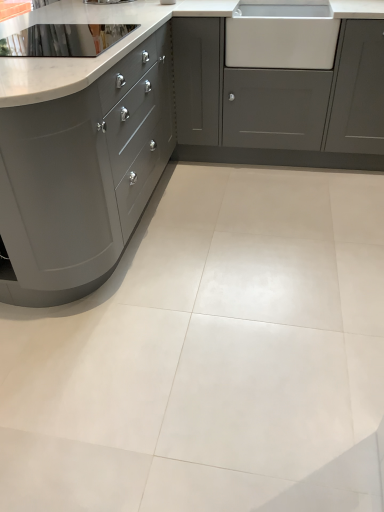
This screenshot has height=512, width=384. Describe the element at coordinates (211, 356) in the screenshot. I see `white glossy tile at center` at that location.

What is the approximate width of white glossy sink at upper right?

23.63 inches.

How much space does matte gray cabinet at center, marked as the second cabinetry in a left-to-right arrangement, occupy vertically?

The height of matte gray cabinet at center, marked as the second cabinetry in a left-to-right arrangement, is 36.86 inches.

Image resolution: width=384 pixels, height=512 pixels. Identify the location of white glossy tile at center. (211, 356).

From the image's perspective, is white glossy tile at center above or below matte gray cabinetry at left, marked as the first cabinetry in a left-to-right arrangement?

Based on their image positions, white glossy tile at center is located beneath matte gray cabinetry at left, marked as the first cabinetry in a left-to-right arrangement.

How different are the orientations of white glossy tile at center and matte gray cabinetry at left, marked as the first cabinetry in a left-to-right arrangement, in degrees?

The facing directions of white glossy tile at center and matte gray cabinetry at left, marked as the first cabinetry in a left-to-right arrangement, are 1.12 degrees apart.

Locate an element on the screen. ceramic tile in front of the matte gray cabinetry at left, marked as the first cabinetry in a left-to-right arrangement is located at coordinates (211, 356).

From a real-world perspective, which is physically below, white glossy tile at center or matte gray cabinetry at left, which is counted as the 2th cabinetry, starting from the right?

white glossy tile at center is physically lower.

Where is `the 2nd cabinetry below the white glossy sink at upper right (from a real-world perspective)`? The image size is (384, 512). the 2nd cabinetry below the white glossy sink at upper right (from a real-world perspective) is located at coordinates (279, 103).

Considering the relative sizes of matte gray cabinet at center, marked as the second cabinetry in a left-to-right arrangement, and white glossy sink at upper right in the image provided, is matte gray cabinet at center, marked as the second cabinetry in a left-to-right arrangement, bigger than white glossy sink at upper right?

Correct, matte gray cabinet at center, marked as the second cabinetry in a left-to-right arrangement, is larger in size than white glossy sink at upper right.

Is white glossy sink at upper right located within matte gray cabinet at center, marked as the second cabinetry in a left-to-right arrangement?

Yes.

From the image's perspective, is white glossy sink at upper right on white glossy tile at center?

Yes, from the image's perspective, white glossy sink at upper right is above white glossy tile at center.

Is white glossy tile at center at the back of white glossy sink at upper right?

No, white glossy sink at upper right's orientation is not away from white glossy tile at center.

What's the angular difference between white glossy sink at upper right and white glossy tile at center's facing directions?

89 degrees.

Which point is more distant from viewer, [312,68] or [82,304]?

The point [312,68] is farther.

Who is smaller, matte gray cabinetry at left, which is counted as the 2th cabinetry, starting from the right, or polished stainless steel sink at upper left?

polished stainless steel sink at upper left.

Considering the positions of point (121, 146) and point (83, 47), is point (121, 146) closer or farther from the camera than point (83, 47)?

Point (121, 146).

From a real-world perspective, which is physically below, matte gray cabinetry at left, marked as the first cabinetry in a left-to-right arrangement, or polished stainless steel sink at upper left?

matte gray cabinetry at left, marked as the first cabinetry in a left-to-right arrangement, from a real-world perspective.

Which object is thinner, matte gray cabinetry at left, which is counted as the 2th cabinetry, starting from the right, or polished stainless steel sink at upper left?

Thinner between the two is polished stainless steel sink at upper left.

Consider the image. Who is bigger, white glossy sink at upper right or polished stainless steel sink at upper left?

With larger size is white glossy sink at upper right.

Is white glossy sink at upper right in front of or behind polished stainless steel sink at upper left in the image?

white glossy sink at upper right is behind polished stainless steel sink at upper left.

Is polished stainless steel sink at upper left surrounding matte gray cabinetry at left, marked as the first cabinetry in a left-to-right arrangement?

No, matte gray cabinetry at left, marked as the first cabinetry in a left-to-right arrangement, is not inside polished stainless steel sink at upper left.

Which is closer to the camera, [9,42] or [148,45]?

Point [9,42] is positioned farther from the camera compared to point [148,45].

Image resolution: width=384 pixels, height=512 pixels. What are the coordinates of `cabinetry that appears in front of the polished stainless steel sink at upper left` in the screenshot? It's located at (82, 176).

In the scene shown: From a real-world perspective, is polished stainless steel sink at upper left physically above matte gray cabinetry at left, marked as the first cabinetry in a left-to-right arrangement?

Yes, from a real-world perspective, polished stainless steel sink at upper left is above matte gray cabinetry at left, marked as the first cabinetry in a left-to-right arrangement.

From the image's perspective, does polished stainless steel sink at upper left appear higher than white glossy sink at upper right?

No, from the image's perspective, polished stainless steel sink at upper left is not on top of white glossy sink at upper right.

Which point is more forward, (84, 56) or (245, 54)?

The point (84, 56) is closer.

From a real-world perspective, is polished stainless steel sink at upper left over white glossy sink at upper right?

Indeed, from a real-world perspective, polished stainless steel sink at upper left stands above white glossy sink at upper right.

Is polished stainless steel sink at upper left far away from white glossy sink at upper right?

No.

Where is `cabinetry on the left of white glossy tile at center`? The image size is (384, 512). cabinetry on the left of white glossy tile at center is located at coordinates (82, 176).

Locate an element on the screen. sink above the matte gray cabinet at center, the first cabinetry positioned from the right (from a real-world perspective) is located at coordinates (281, 35).

Which object lies further to the anchor point white glossy tile at center, white glossy sink at upper right or matte gray cabinet at center, marked as the second cabinetry in a left-to-right arrangement?

Among the two, white glossy sink at upper right is located further to white glossy tile at center.

Based on their spatial positions, is white glossy tile at center or polished stainless steel sink at upper left further from matte gray cabinetry at left, which is counted as the 2th cabinetry, starting from the right?

The object further to matte gray cabinetry at left, which is counted as the 2th cabinetry, starting from the right, is white glossy tile at center.

Considering their positions, is matte gray cabinetry at left, marked as the first cabinetry in a left-to-right arrangement, positioned closer to polished stainless steel sink at upper left than matte gray cabinet at center, marked as the second cabinetry in a left-to-right arrangement?

Based on the image, matte gray cabinetry at left, marked as the first cabinetry in a left-to-right arrangement, appears to be nearer to polished stainless steel sink at upper left.

Considering their positions, is matte gray cabinetry at left, which is counted as the 2th cabinetry, starting from the right, positioned further to white glossy tile at center than white glossy sink at upper right?

white glossy sink at upper right.

In the scene shown: Looking at the image, which one is located closer to white glossy sink at upper right, white glossy tile at center or matte gray cabinetry at left, which is counted as the 2th cabinetry, starting from the right?

matte gray cabinetry at left, which is counted as the 2th cabinetry, starting from the right, is positioned closer to the anchor white glossy sink at upper right.

Looking at this image, which object lies further to the anchor point matte gray cabinet at center, the first cabinetry positioned from the right, white glossy tile at center or matte gray cabinetry at left, marked as the first cabinetry in a left-to-right arrangement?

Based on the image, white glossy tile at center appears to be further to matte gray cabinet at center, the first cabinetry positioned from the right.

Which object lies further to the anchor point matte gray cabinetry at left, marked as the first cabinetry in a left-to-right arrangement, matte gray cabinet at center, the first cabinetry positioned from the right, or white glossy sink at upper right?

The object further to matte gray cabinetry at left, marked as the first cabinetry in a left-to-right arrangement, is matte gray cabinet at center, the first cabinetry positioned from the right.

Which object lies nearer to the anchor point polished stainless steel sink at upper left, matte gray cabinet at center, the first cabinetry positioned from the right, or white glossy tile at center?

matte gray cabinet at center, the first cabinetry positioned from the right, lies closer to polished stainless steel sink at upper left than the other object.

Identify the location of appliance between matte gray cabinetry at left, marked as the first cabinetry in a left-to-right arrangement, and white glossy sink at upper right from left to right. (64, 40).

The image size is (384, 512). I want to click on appliance between matte gray cabinetry at left, which is counted as the 2th cabinetry, starting from the right, and matte gray cabinet at center, marked as the second cabinetry in a left-to-right arrangement, so click(x=64, y=40).

Locate an element on the screen. This screenshot has height=512, width=384. ceramic tile between matte gray cabinetry at left, which is counted as the 2th cabinetry, starting from the right, and matte gray cabinet at center, the first cabinetry positioned from the right is located at coordinates (211, 356).

Find the location of a particular element. The image size is (384, 512). appliance between white glossy sink at upper right and white glossy tile at center in the up-down direction is located at coordinates (64, 40).